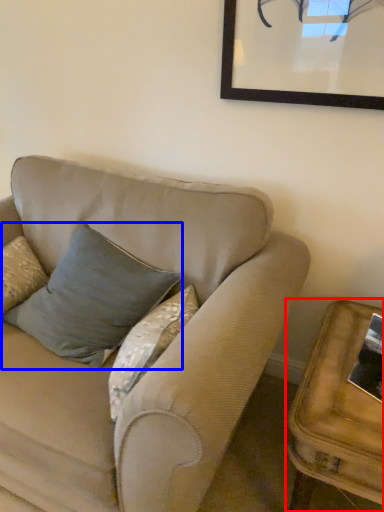
Question: Which object appears farthest to the camera in this image, table (highlighted by a red box) or pillow (highlighted by a blue box)?

Choices:
 (A) table
 (B) pillow

Answer: (B)